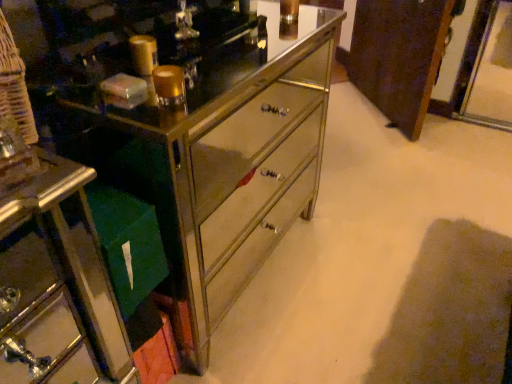
Identify the location of free space in front of brown wood cabinet at center. (391, 155).